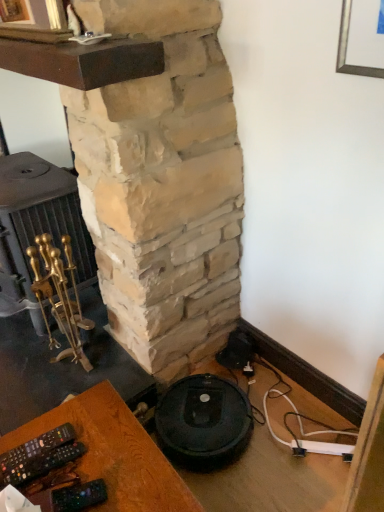
At what (x,y) coordinates should I click in order to perform the action: click on natural stone fireplace at center. Please return your answer as a coordinate pair (x, y). Looking at the image, I should click on (163, 184).

The width and height of the screenshot is (384, 512). What do you see at coordinates (38, 226) in the screenshot? I see `gold polished fireplace tools at left` at bounding box center [38, 226].

In order to click on natural stone fireplace at center in this screenshot , I will do `click(163, 184)`.

From the image's perspective, is gold polished fireplace tools at left above or below natural stone fireplace at center?

From the image's perspective, gold polished fireplace tools at left appears below natural stone fireplace at center.

Can you confirm if gold polished fireplace tools at left is taller than natural stone fireplace at center?

No.

Is the depth of gold polished fireplace tools at left greater than that of natural stone fireplace at center?

Yes, gold polished fireplace tools at left is further from the viewer.

Is point (7, 218) closer to camera compared to point (196, 199)?

No, (7, 218) is further to viewer.

Consider the image. Can you confirm if black plastic remote control at lower left is positioned to the right of gold polished fireplace tools at left?

Yes, black plastic remote control at lower left is to the right of gold polished fireplace tools at left.

Is black plastic remote control at lower left in contact with gold polished fireplace tools at left?

No.

Between black plastic remote control at lower left and gold polished fireplace tools at left, which one has smaller width?

gold polished fireplace tools at left is thinner.

Which of these two, natural stone fireplace at center or black plastic remote control at lower left, stands shorter?

With less height is black plastic remote control at lower left.

Does natural stone fireplace at center have a larger size compared to black plastic remote control at lower left?

Yes.

Locate an element on the screen. pillar lying on the left of black plastic remote control at lower left is located at coordinates (163, 184).

From the image's perspective, between gold polished fireplace tools at left and black plastic remote control at lower left, who is located below?

black plastic remote control at lower left.

Who is more distant, gold polished fireplace tools at left or black plastic remote control at lower left?

gold polished fireplace tools at left.

Locate an element on the screen. furniture in front of the gold polished fireplace tools at left is located at coordinates (114, 453).

What's the angular difference between gold polished fireplace tools at left and black plastic remote control at lower left's facing directions?

There is a 1.8-degree angle between the facing directions of gold polished fireplace tools at left and black plastic remote control at lower left.

From the image's perspective, is black plastic remote control at lower left located above or below natural stone fireplace at center?

black plastic remote control at lower left is below natural stone fireplace at center.

Can you confirm if black plastic remote control at lower left is taller than natural stone fireplace at center?

No, black plastic remote control at lower left is not taller than natural stone fireplace at center.

Could you tell me if black plastic remote control at lower left is facing natural stone fireplace at center?

No, black plastic remote control at lower left does not turn towards natural stone fireplace at center.

Is natural stone fireplace at center inside or outside of gold polished fireplace tools at left?

natural stone fireplace at center is spatially situated outside gold polished fireplace tools at left.

Based on the photo, from a real-world perspective, does natural stone fireplace at center stand above gold polished fireplace tools at left?

Yes, from a real-world perspective, natural stone fireplace at center is over gold polished fireplace tools at left

Does point (200, 109) come closer to viewer compared to point (2, 284)?

Yes.

The image size is (384, 512). Identify the location of pillar lying in front of the gold polished fireplace tools at left. (163, 184).

Identify the location of stove above the black plastic remote control at lower left (from the image's perspective). The image size is (384, 512). (38, 226).

When comparing their distances from black plastic remote control at lower left, does natural stone fireplace at center or gold polished fireplace tools at left seem closer?

natural stone fireplace at center.

When comparing their distances from natural stone fireplace at center, does gold polished fireplace tools at left or black plastic remote control at lower left seem further?

black plastic remote control at lower left.

From the image, which object appears to be farther from natural stone fireplace at center, black plastic remote control at lower left or gold polished fireplace tools at left?

The object further to natural stone fireplace at center is black plastic remote control at lower left.

Looking at the image, which one is located further to black plastic remote control at lower left, gold polished fireplace tools at left or natural stone fireplace at center?

Based on the image, gold polished fireplace tools at left appears to be further to black plastic remote control at lower left.

Based on their spatial positions, is natural stone fireplace at center or black plastic remote control at lower left further from gold polished fireplace tools at left?

black plastic remote control at lower left is positioned further to the anchor gold polished fireplace tools at left.

Estimate the real-world distances between objects in this image. Which object is closer to gold polished fireplace tools at left, black plastic remote control at lower left or natural stone fireplace at center?

Among the two, natural stone fireplace at center is located nearer to gold polished fireplace tools at left.

Where is `stove between natural stone fireplace at center and black plastic remote control at lower left from top to bottom`? This screenshot has height=512, width=384. stove between natural stone fireplace at center and black plastic remote control at lower left from top to bottom is located at coordinates (x=38, y=226).